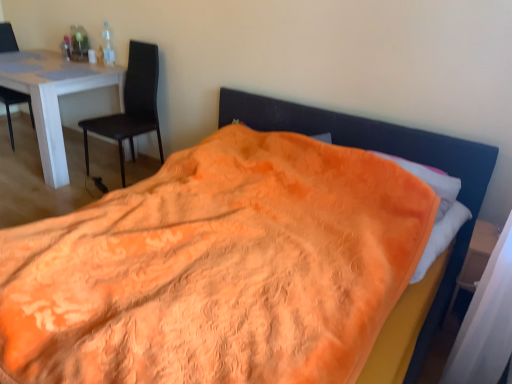
What is the approximate width of white glossy table at left?

It is 32.22 inches.

Identify the location of white glossy table at left. This screenshot has width=512, height=384. (54, 97).

You are a GUI agent. You are given a task and a screenshot of the screen. Output one action in this format:
    pyautogui.click(x=<x>, y=<y>)
    Task: Click on the matte black chair at left, which appears as the second chair when viewed from the left
    The image size is (512, 384).
    Given the screenshot: What is the action you would take?
    pyautogui.click(x=132, y=104)

You are a GUI agent. You are given a task and a screenshot of the screen. Output one action in this format:
    pyautogui.click(x=<x>, y=<y>)
    Task: Click on the wooden at right
    The height and width of the screenshot is (384, 512).
    Given the screenshot: What is the action you would take?
    pyautogui.click(x=476, y=256)

This screenshot has width=512, height=384. What do you see at coordinates (476, 256) in the screenshot? I see `wooden at right` at bounding box center [476, 256].

How much space does matte black chair at left, placed as the 2th chair when sorted from right to left, occupy horizontally?

The width of matte black chair at left, placed as the 2th chair when sorted from right to left, is 54.07 centimeters.

At what (x,y) coordinates should I click in order to perform the action: click on white glossy table at left. Please return your answer as a coordinate pair (x, y). Image resolution: width=512 pixels, height=384 pixels. Looking at the image, I should click on (54, 97).

Considering the sizes of objects wooden at right and white glossy table at left in the image provided, who is taller, wooden at right or white glossy table at left?

white glossy table at left.

Are wooden at right and white glossy table at left far apart?

wooden at right is positioned a significant distance from white glossy table at left.

Is wooden at right situated inside white glossy table at left or outside?

wooden at right exists outside the volume of white glossy table at left.

Is white glossy table at left bigger than matte black chair at left, which is the first chair from right to left?

Correct, white glossy table at left is larger in size than matte black chair at left, which is the first chair from right to left.

From a real-world perspective, is white glossy table at left above or below matte black chair at left, which appears as the second chair when viewed from the left?

In terms of real-world spatial position, white glossy table at left is below matte black chair at left, which appears as the second chair when viewed from the left.

Looking at this image, visually, is white glossy table at left positioned to the left or to the right of matte black chair at left, which appears as the second chair when viewed from the left?

white glossy table at left is positioned on matte black chair at left, which appears as the second chair when viewed from the left,'s left side.

Is the depth of white glossy table at left greater than that of matte black chair at left, which is the 1th chair in left-to-right order?

No.

From the image's perspective, would you say white glossy table at left is shown under matte black chair at left, placed as the 2th chair when sorted from right to left?

Yes, from the image's perspective, white glossy table at left is beneath matte black chair at left, placed as the 2th chair when sorted from right to left.

Is matte black chair at left, which is the 1th chair in left-to-right order, completely or partially inside white glossy table at left?

Yes, matte black chair at left, which is the 1th chair in left-to-right order, is a part of white glossy table at left.

Does matte black chair at left, which is the 1th chair in left-to-right order, touch wooden at right?

They are not placed beside each other.

From a real-world perspective, is matte black chair at left, placed as the 2th chair when sorted from right to left, on wooden at right?

Indeed, from a real-world perspective, matte black chair at left, placed as the 2th chair when sorted from right to left, stands above wooden at right.

Is point (15, 43) more distant than point (479, 254)?

Yes, it is.

Is matte black chair at left, placed as the 2th chair when sorted from right to left, facing away from wooden at right?

No, wooden at right is not at the back of matte black chair at left, placed as the 2th chair when sorted from right to left.

From the image's perspective, is wooden at right located beneath matte black chair at left, which is the first chair from right to left?

Correct, wooden at right appears lower than matte black chair at left, which is the first chair from right to left, in the image.

What's the angular difference between wooden at right and matte black chair at left, which appears as the second chair when viewed from the left,'s facing directions?

3.49 degrees.

Is wooden at right oriented towards matte black chair at left, which appears as the second chair when viewed from the left?

No, wooden at right is not facing towards matte black chair at left, which appears as the second chair when viewed from the left.

Is wooden at right not within matte black chair at left, which is the first chair from right to left?

Yes.

From a real-world perspective, is matte black chair at left, placed as the 2th chair when sorted from right to left, above or below white glossy table at left?

In terms of real-world spatial position, matte black chair at left, placed as the 2th chair when sorted from right to left, is above white glossy table at left.

Are matte black chair at left, placed as the 2th chair when sorted from right to left, and white glossy table at left making contact?

No.

Which object is wider, matte black chair at left, placed as the 2th chair when sorted from right to left, or white glossy table at left?

With larger width is white glossy table at left.

How different are the orientations of matte black chair at left, placed as the 2th chair when sorted from right to left, and white glossy table at left in degrees?

85.5 degrees.

Could you tell me if matte black chair at left, which appears as the second chair when viewed from the left, is facing wooden at right?

No.

Between point (158, 120) and point (493, 249), which one is positioned in front?

The point (493, 249) is closer.

From the image's perspective, is matte black chair at left, which is the first chair from right to left, above or below wooden at right?

matte black chair at left, which is the first chair from right to left, is above wooden at right.

In the scene shown: Which of these two, matte black chair at left, which is the first chair from right to left, or wooden at right, stands shorter?

wooden at right is shorter.

Locate an element on the screen. The height and width of the screenshot is (384, 512). side table that appears below the white glossy table at left (from a real-world perspective) is located at coordinates (476, 256).

Find the location of `table behind the matte black chair at left, which appears as the second chair when viewed from the left`. table behind the matte black chair at left, which appears as the second chair when viewed from the left is located at coordinates (54, 97).

From the image, which object appears to be nearer to matte black chair at left, placed as the 2th chair when sorted from right to left, white glossy table at left or matte black chair at left, which appears as the second chair when viewed from the left?

The object closer to matte black chair at left, placed as the 2th chair when sorted from right to left, is white glossy table at left.

Estimate the real-world distances between objects in this image. Which object is closer to matte black chair at left, placed as the 2th chair when sorted from right to left, wooden at right or white glossy table at left?

white glossy table at left lies closer to matte black chair at left, placed as the 2th chair when sorted from right to left, than the other object.

Which object lies further to the anchor point wooden at right, matte black chair at left, which is the 1th chair in left-to-right order, or white glossy table at left?

matte black chair at left, which is the 1th chair in left-to-right order, is further to wooden at right.

From the image, which object appears to be farther from matte black chair at left, placed as the 2th chair when sorted from right to left, white glossy table at left or wooden at right?

wooden at right lies further to matte black chair at left, placed as the 2th chair when sorted from right to left, than the other object.

Estimate the real-world distances between objects in this image. Which object is closer to wooden at right, white glossy table at left or matte black chair at left, which is the 1th chair in left-to-right order?

The object closer to wooden at right is white glossy table at left.

Looking at the image, which one is located further to white glossy table at left, matte black chair at left, which appears as the second chair when viewed from the left, or wooden at right?

Among the two, wooden at right is located further to white glossy table at left.

When comparing their distances from matte black chair at left, placed as the 2th chair when sorted from right to left, does matte black chair at left, which is the first chair from right to left, or white glossy table at left seem closer?

Among the two, white glossy table at left is located nearer to matte black chair at left, placed as the 2th chair when sorted from right to left.

Consider the image. When comparing their distances from white glossy table at left, does wooden at right or matte black chair at left, which is the first chair from right to left, seem closer?

The object closer to white glossy table at left is matte black chair at left, which is the first chair from right to left.

I want to click on table situated between matte black chair at left, placed as the 2th chair when sorted from right to left, and wooden at right from left to right, so click(54, 97).

This screenshot has width=512, height=384. Find the location of `chair located between white glossy table at left and wooden at right in the left-right direction`. chair located between white glossy table at left and wooden at right in the left-right direction is located at coordinates (132, 104).

Where is `table located between matte black chair at left, placed as the 2th chair when sorted from right to left, and matte black chair at left, which is the first chair from right to left, in the left-right direction`? This screenshot has width=512, height=384. table located between matte black chair at left, placed as the 2th chair when sorted from right to left, and matte black chair at left, which is the first chair from right to left, in the left-right direction is located at coordinates (54, 97).

You are a GUI agent. You are given a task and a screenshot of the screen. Output one action in this format:
    pyautogui.click(x=<x>, y=<y>)
    Task: Click on the chair between matte black chair at left, which is the 1th chair in left-to-right order, and wooden at right from left to right
    Image resolution: width=512 pixels, height=384 pixels.
    Given the screenshot: What is the action you would take?
    pyautogui.click(x=132, y=104)